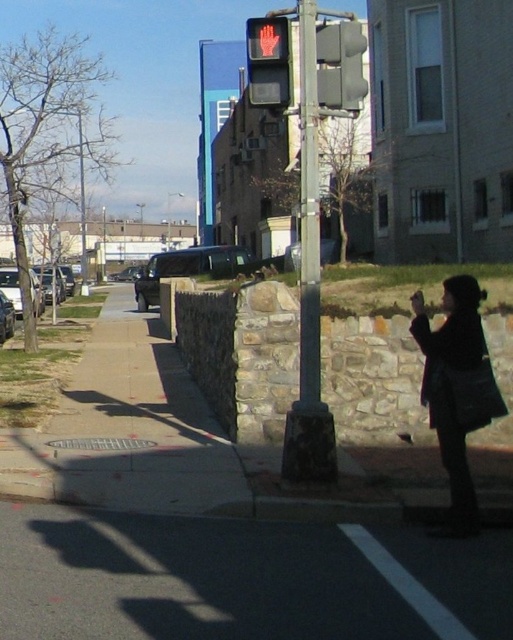
Is black matte coat at lower right further to camera compared to red matte pedestrian signal at upper center?

No, black matte coat at lower right is in front of red matte pedestrian signal at upper center.

Can you confirm if black matte coat at lower right is thinner than red matte pedestrian signal at upper center?

Indeed, black matte coat at lower right has a lesser width compared to red matte pedestrian signal at upper center.

Measure the distance between point (x=473, y=284) and camera.

Point (x=473, y=284) is 21.07 feet from camera.

This screenshot has height=640, width=513. Find the location of `black matte coat at lower right`. black matte coat at lower right is located at coordinates (457, 388).

Between dark asphalt pavement at lower center and metallic gray pole at center, which one has more height?

metallic gray pole at center is taller.

Who is more forward, [329,588] or [333,477]?

Point [329,588] is in front.

Where is `dark asphalt pavement at lower center`? The height and width of the screenshot is (640, 513). dark asphalt pavement at lower center is located at coordinates (243, 579).

Is silver metallic sedan at left positioned behind metallic silver car at lower left?

No.

Is point (40, 300) positioned after point (6, 336)?

That is True.

This screenshot has width=513, height=640. I want to click on silver metallic sedan at left, so click(10, 288).